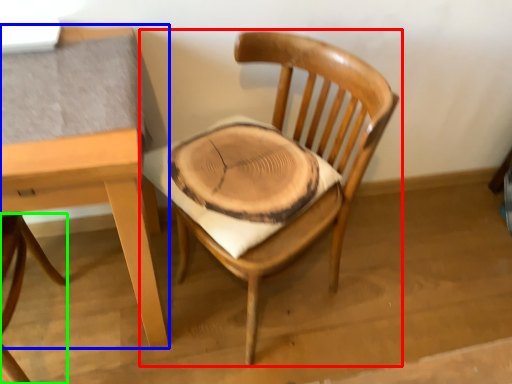
Question: Based on their relative distances, which object is nearer to chair (highlighted by a red box)? Choose from table (highlighted by a blue box) and chair (highlighted by a green box).

Choices:
 (A) table
 (B) chair

Answer: (A)